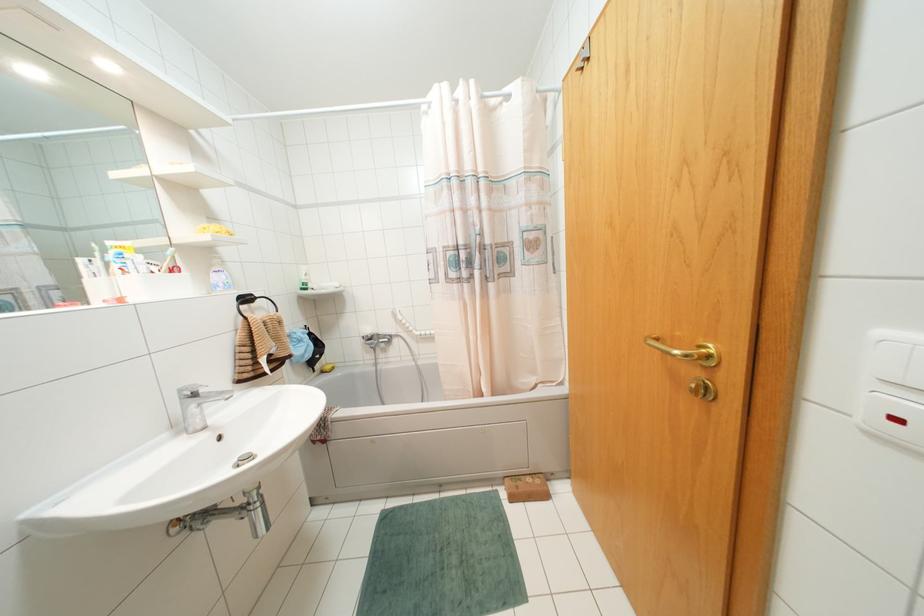
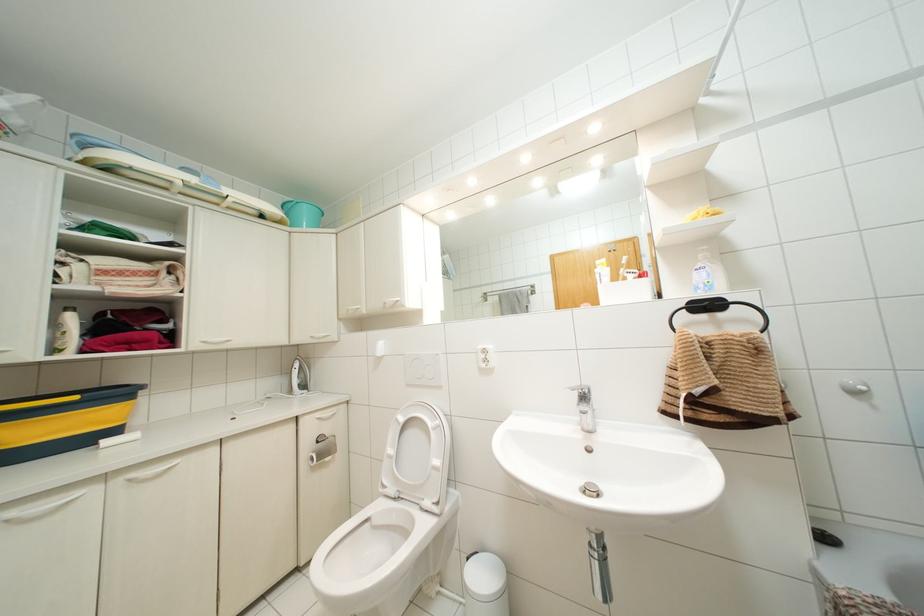
In the second image, find the point that corresponds to point (193, 395) in the first image.

(584, 395)